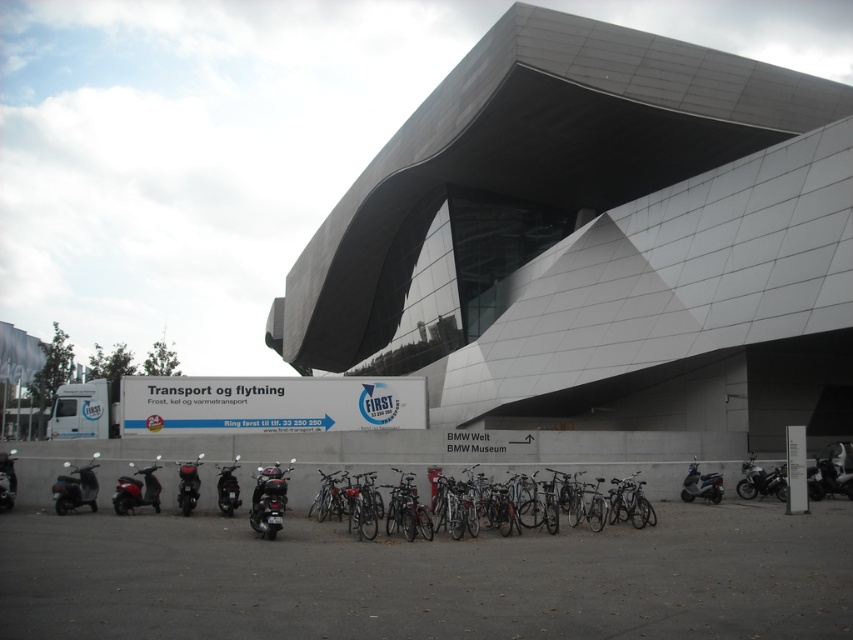
Question: Is metallic silver scooter at lower left positioned before metallic silver scooter at lower right?

Choices:
 (A) no
 (B) yes

Answer: (B)

Question: Can you confirm if shiny black motorcycle at center is bigger than metallic silver motorcycle at lower left?

Choices:
 (A) yes
 (B) no

Answer: (B)

Question: Which of the following is the farthest from the observer?

Choices:
 (A) (12, 506)
 (B) (837, 444)
 (C) (747, 493)
 (D) (222, 508)

Answer: (B)

Question: Which object is positioned closest to the shiny black scooter at center?

Choices:
 (A) shiny black motorcycle at center
 (B) matte black scooter at lower left

Answer: (A)

Question: Can you confirm if metallic silver scooter at lower left is positioned to the right of shiny black scooter at center?

Choices:
 (A) no
 (B) yes

Answer: (A)

Question: Which object is closer to the camera taking this photo?

Choices:
 (A) matte black scooter at lower left
 (B) metallic silver motorcycle at lower left

Answer: (B)